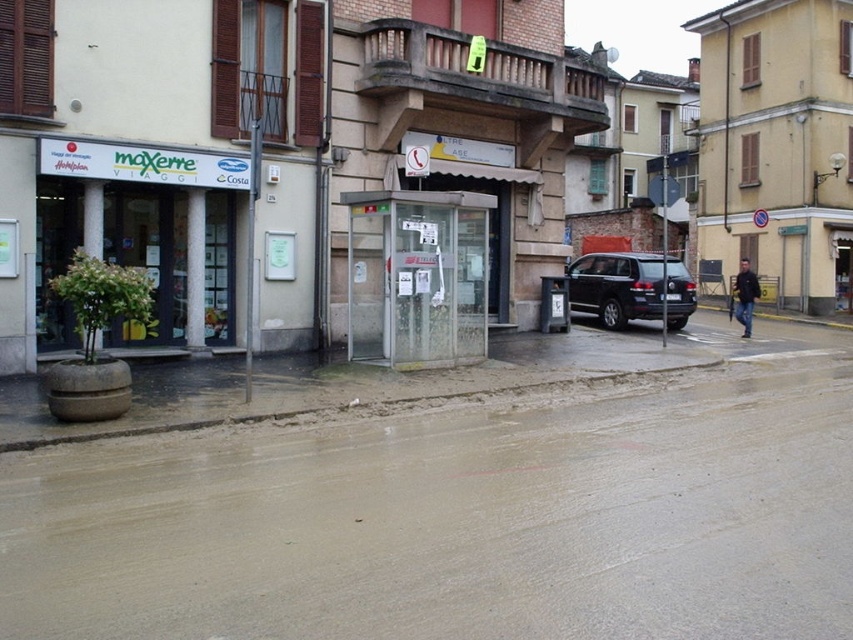
You are a pedestrian trying to cross the flooded street. You see a transparent glass booth at center and a dark blue jacket at lower right. Which object is closer to the left side of the street?

The transparent glass booth at center is positioned on the left side of dark blue jacket at lower right, so it is closer to the left side of the street.

You are standing on the flooded street and want to reach a safe area. There are two points marked on the map. Which point, point 1 at coordinates (399,340) or point 2 at coordinates (656,296), is closer to you and therefore safer to move towards?

Point 1 at coordinates (399,340) is closer to the viewer than point 2 at coordinates (656,296), so it is safer to move towards point 1 at coordinates (399,340).